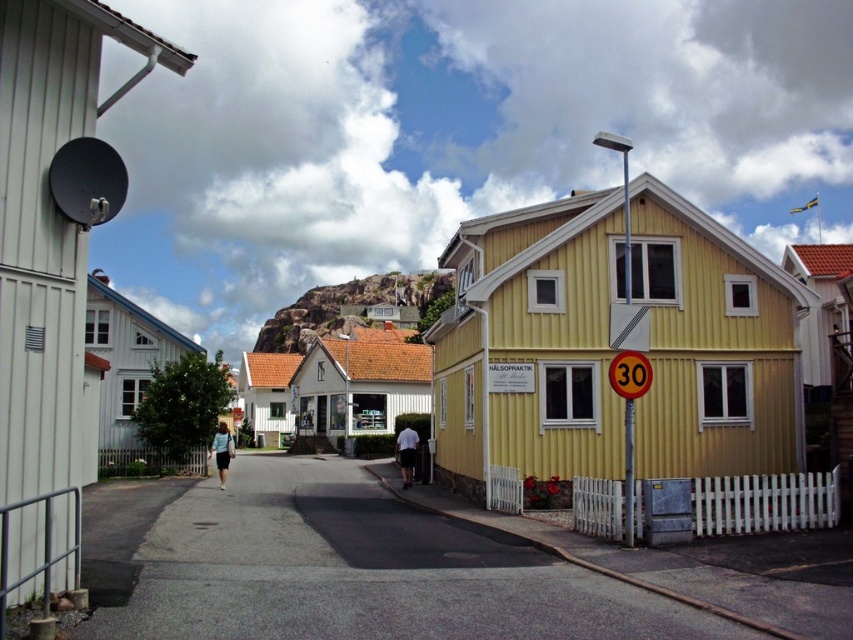
Between yellow plastic speed limit sign at right and light blue denim jacket at center, which one has less height?

Standing shorter between the two is yellow plastic speed limit sign at right.

Can you confirm if yellow plastic speed limit sign at right is bigger than light blue denim jacket at center?

No, yellow plastic speed limit sign at right is not bigger than light blue denim jacket at center.

Find the location of a particular element. yellow plastic speed limit sign at right is located at coordinates (630, 374).

Consider the image. Which is more to the left, yellow plastic speed limit sign at right or white cotton shorts at center?

Positioned to the left is white cotton shorts at center.

Looking at this image, is yellow plastic speed limit sign at right to the left of white cotton shorts at center from the viewer's perspective?

In fact, yellow plastic speed limit sign at right is to the right of white cotton shorts at center.

Is point (630, 390) farther from camera compared to point (402, 444)?

No, it is in front of (402, 444).

You are a GUI agent. You are given a task and a screenshot of the screen. Output one action in this format:
    pyautogui.click(x=<x>, y=<y>)
    Task: Click on the yellow plastic speed limit sign at right
    This screenshot has height=640, width=853.
    Given the screenshot: What is the action you would take?
    pyautogui.click(x=630, y=374)

Is the position of white cotton shorts at center more distant than that of light blue denim jacket at center?

That is True.

Where is `white cotton shorts at center`? white cotton shorts at center is located at coordinates (407, 452).